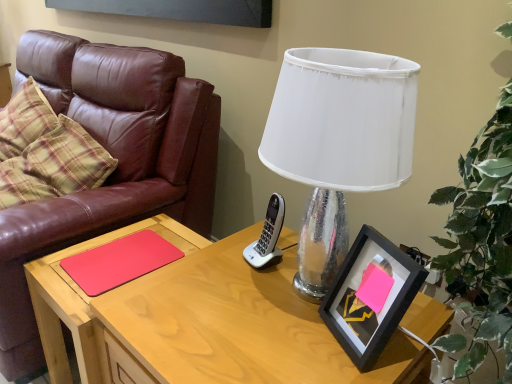
Locate an element on the screen. The image size is (512, 384). black matte picture frame at right is located at coordinates (367, 301).

You are a GUI agent. You are given a task and a screenshot of the screen. Output one action in this format:
    pyautogui.click(x=<x>, y=<y>)
    Task: Click on the plaid fabric pillow at left
    The image size is (512, 384).
    Given the screenshot: What is the action you would take?
    pyautogui.click(x=46, y=151)

The image size is (512, 384). Identify the location of brown leather couch at left. (113, 156).

Find the location of `black matte picture frame at right`. black matte picture frame at right is located at coordinates (367, 301).

Does plaid fabric pillow at left have a greater width compared to wooden desk at center?

No, plaid fabric pillow at left is not wider than wooden desk at center.

Considering the relative positions of plaid fabric pillow at left and wooden desk at center in the image provided, is plaid fabric pillow at left in front of wooden desk at center?

No, it is not.

Is wooden desk at center completely or partially inside plaid fabric pillow at left?

No, wooden desk at center is not inside plaid fabric pillow at left.

From the image's perspective, is wooden desk at center above plaid fabric pillow at left?

No, from the image's perspective, wooden desk at center is not over plaid fabric pillow at left.

Looking at this image, how many degrees apart are the facing directions of wooden desk at center and plaid fabric pillow at left?

The angle between the facing direction of wooden desk at center and the facing direction of plaid fabric pillow at left is 4.07 degrees.

Is wooden desk at center closer to camera compared to plaid fabric pillow at left?

Yes.

In terms of size, does wooden desk at center appear bigger or smaller than plaid fabric pillow at left?

Clearly, wooden desk at center is larger in size than plaid fabric pillow at left.

Does wooden desk at center touch black matte picture frame at right?

No.

From a real-world perspective, which object rests below the other?

wooden desk at center, from a real-world perspective.

Which is behind, wooden desk at center or black matte picture frame at right?

black matte picture frame at right is more distant.

From the image's perspective, is plaid fabric pillow at left above or below matte pink notepad at center?

plaid fabric pillow at left is above matte pink notepad at center.

Considering the sizes of objects plaid fabric pillow at left and matte pink notepad at center in the image provided, who is shorter, plaid fabric pillow at left or matte pink notepad at center?

Standing shorter between the two is matte pink notepad at center.

From the picture: From a real-world perspective, is plaid fabric pillow at left positioned over matte pink notepad at center based on gravity?

Indeed, from a real-world perspective, plaid fabric pillow at left stands above matte pink notepad at center.

Is plaid fabric pillow at left spatially inside matte pink notepad at center, or outside of it?

plaid fabric pillow at left cannot be found inside matte pink notepad at center.

Is the position of brown leather couch at left less distant than that of white fabric lampshade at upper center?

No, it is behind white fabric lampshade at upper center.

Is brown leather couch at left far away from white fabric lampshade at upper center?

Actually, brown leather couch at left and white fabric lampshade at upper center are a little close together.

From the image's perspective, is brown leather couch at left above or below white fabric lampshade at upper center?

brown leather couch at left is situated higher than white fabric lampshade at upper center in the image.

What's the angular difference between brown leather couch at left and white fabric lampshade at upper center's facing directions?

brown leather couch at left and white fabric lampshade at upper center are facing 1.08 degrees away from each other.

Which is in front, point (354, 273) or point (48, 308)?

The point (354, 273) is in front.

Can red matte wood side table at left be found inside black matte picture frame at right?

No, red matte wood side table at left is located outside of black matte picture frame at right.

The height and width of the screenshot is (384, 512). What are the coordinates of `picture frame that is on the right side of red matte wood side table at left` in the screenshot? It's located at (367, 301).

From the image's perspective, which one is positioned higher, black matte picture frame at right or red matte wood side table at left?

black matte picture frame at right, from the image's perspective.

Between matte pink notepad at center and red matte wood side table at left, which one has more height?

Standing taller between the two is red matte wood side table at left.

Between matte pink notepad at center and red matte wood side table at left, which one is positioned behind?

Positioned behind is matte pink notepad at center.

Consider the image. Visually, is matte pink notepad at center positioned to the left or to the right of red matte wood side table at left?

In the image, matte pink notepad at center appears on the right side of red matte wood side table at left.

The height and width of the screenshot is (384, 512). Identify the location of desk beneath the plaid fabric pillow at left (from a real-world perspective). (200, 322).

Find the location of `desk in front of the plaid fabric pillow at left`. desk in front of the plaid fabric pillow at left is located at coordinates (200, 322).

Looking at the image, which one is located further to white fabric lampshade at upper center, brown leather couch at left or matte pink notepad at center?

Based on the image, brown leather couch at left appears to be further to white fabric lampshade at upper center.

Which object lies nearer to the anchor point black matte picture frame at right, wooden desk at center or matte pink notepad at center?

Among the two, wooden desk at center is located nearer to black matte picture frame at right.

In the scene shown: Estimate the real-world distances between objects in this image. Which object is closer to matte pink notepad at center, red matte wood side table at left or plaid fabric pillow at left?

The object closer to matte pink notepad at center is red matte wood side table at left.

When comparing their distances from white fabric lampshade at upper center, does plaid fabric pillow at left or brown leather couch at left seem further?

plaid fabric pillow at left lies further to white fabric lampshade at upper center than the other object.

Based on their spatial positions, is wooden desk at center or brown leather couch at left closer to black matte picture frame at right?

wooden desk at center.

From the image, which object appears to be farther from wooden desk at center, red matte wood side table at left or brown leather couch at left?

The object further to wooden desk at center is brown leather couch at left.

Which object lies nearer to the anchor point plaid fabric pillow at left, red matte wood side table at left or brown leather couch at left?

Based on the image, brown leather couch at left appears to be nearer to plaid fabric pillow at left.

From the image, which object appears to be nearer to plaid fabric pillow at left, black matte picture frame at right or matte pink notepad at center?

matte pink notepad at center is closer to plaid fabric pillow at left.

Identify the location of desk between matte pink notepad at center and white fabric lampshade at upper center in the horizontal direction. Image resolution: width=512 pixels, height=384 pixels. (200, 322).

Locate an element on the screen. The width and height of the screenshot is (512, 384). chair between plaid fabric pillow at left and red matte wood side table at left in the horizontal direction is located at coordinates (113, 156).

Identify the location of picture frame between white fabric lampshade at upper center and wooden desk at center in the up-down direction. (367, 301).

The width and height of the screenshot is (512, 384). Identify the location of side table between brown leather couch at left and matte pink notepad at center from left to right. (81, 301).